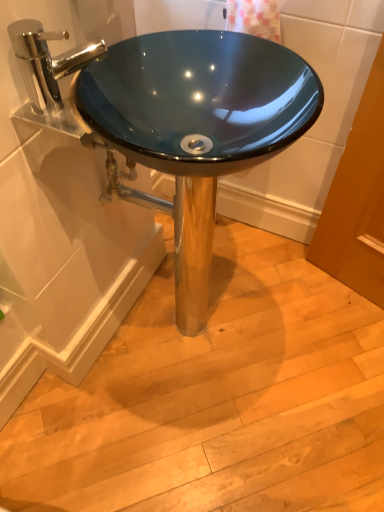
Question: Is glossy blue glass sink at center facing away from polished chrome faucet at upper left?

Choices:
 (A) no
 (B) yes

Answer: (A)

Question: From the image's perspective, does glossy blue glass sink at center appear higher than polished chrome faucet at upper left?

Choices:
 (A) no
 (B) yes

Answer: (A)

Question: Does glossy blue glass sink at center have a lesser width compared to polished chrome faucet at upper left?

Choices:
 (A) no
 (B) yes

Answer: (A)

Question: Can you confirm if glossy blue glass sink at center is bigger than polished chrome faucet at upper left?

Choices:
 (A) yes
 (B) no

Answer: (A)

Question: Can you confirm if glossy blue glass sink at center is shorter than polished chrome faucet at upper left?

Choices:
 (A) no
 (B) yes

Answer: (A)

Question: Can polished chrome faucet at upper left be found inside glossy blue glass sink at center?

Choices:
 (A) yes
 (B) no

Answer: (B)

Question: Can you confirm if polished chrome faucet at upper left is shorter than glossy blue glass sink at center?

Choices:
 (A) no
 (B) yes

Answer: (B)

Question: From a real-world perspective, is polished chrome faucet at upper left positioned under glossy blue glass sink at center based on gravity?

Choices:
 (A) no
 (B) yes

Answer: (A)

Question: Is polished chrome faucet at upper left thinner than glossy blue glass sink at center?

Choices:
 (A) no
 (B) yes

Answer: (B)

Question: From a real-world perspective, is polished chrome faucet at upper left located higher than glossy blue glass sink at center?

Choices:
 (A) no
 (B) yes

Answer: (B)

Question: Is polished chrome faucet at upper left at the left side of glossy blue glass sink at center?

Choices:
 (A) no
 (B) yes

Answer: (B)

Question: Considering the relative sizes of polished chrome faucet at upper left and glossy blue glass sink at center in the image provided, is polished chrome faucet at upper left taller than glossy blue glass sink at center?

Choices:
 (A) no
 (B) yes

Answer: (A)

Question: Is glossy blue glass sink at center inside or outside of polished chrome faucet at upper left?

Choices:
 (A) inside
 (B) outside

Answer: (B)